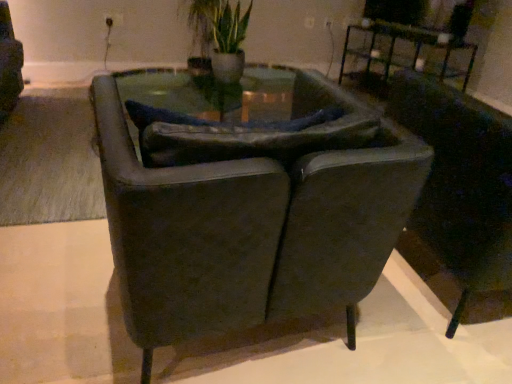
I want to click on vacant space situated on the left part of suede-like dark brown armchair at center, the second chair positioned from the right, so click(x=61, y=278).